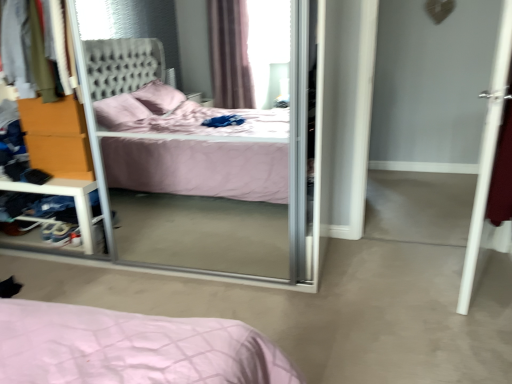
At what (x,y) coordinates should I click in order to perform the action: click on free space between white smooth door at right and transparent glass screen door at center. Please return your answer as a coordinate pair (x, y). This screenshot has height=384, width=512. Looking at the image, I should click on tap(367, 269).